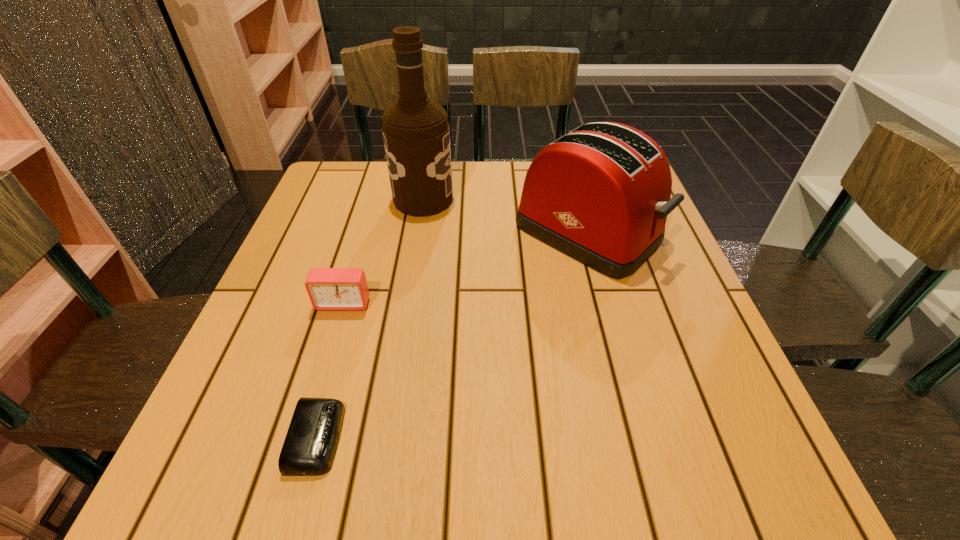
I want to click on vacant area between the farther alarm clock and the shorter alarm clock, so click(330, 370).

Identify which object is located as the nearest to the shorter alarm clock. Please provide its 2D coordinates. Your answer should be formatted as a tuple, i.e. [(x, y)], where the tuple contains the x and y coordinates of a point satisfying the conditions above.

[(328, 288)]

Where is `object that can be found as the third closest to the taller alarm clock`? object that can be found as the third closest to the taller alarm clock is located at coordinates (600, 194).

Locate an element on the screen. Image resolution: width=960 pixels, height=540 pixels. free space that satisfies the following two spatial constraints: 1. on the label of the tallest object; 2. on the front-facing side of the second shortest object is located at coordinates (407, 303).

This screenshot has width=960, height=540. Find the location of `free point that satisfies the following two spatial constraints: 1. on the label of the toaster; 2. on the right side of the alcohol`. free point that satisfies the following two spatial constraints: 1. on the label of the toaster; 2. on the right side of the alcohol is located at coordinates (419, 232).

Image resolution: width=960 pixels, height=540 pixels. Find the location of `free spot that satisfies the following two spatial constraints: 1. on the label of the tallest object; 2. on the front-facing side of the taller alarm clock`. free spot that satisfies the following two spatial constraints: 1. on the label of the tallest object; 2. on the front-facing side of the taller alarm clock is located at coordinates (407, 303).

At what (x,y) coordinates should I click in order to perform the action: click on free location that satisfies the following two spatial constraints: 1. on the label of the tallest object; 2. on the front-facing side of the third farthest object. Please return your answer as a coordinate pair (x, y). Looking at the image, I should click on (407, 303).